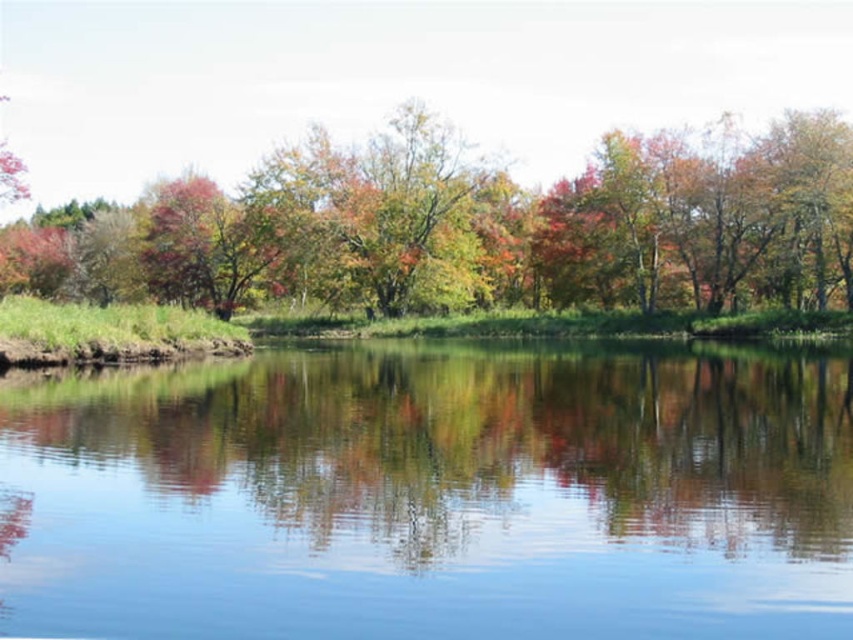
You are an artist planning to paint the scene. You want to ensure the clear water at center and multicolored foliage at center are both visible. Given their sizes, which element should you prioritize in terms of space allocation in your painting?

The multicolored foliage at center occupies more space than the clear water at center, so you should prioritize depicting the multicolored foliage at center with a larger area in your painting to maintain the scene balance.

You are standing on the grassy bank in the foreground of the scene. You see the clear water at center and the multicolored foliage at center. Which object is closer to you?

The clear water at center is located below multicolored foliage at center, so the multicolored foliage at center is closer to you.

You are standing on the grassy bank and want to take a photo of the clear water at center and the multicolored foliage at center. Since both are at the center, which one will appear closer to you in the photo?

The clear water at center is in front of multicolored foliage at center, so the clear water at center will appear closer to you in the photo.